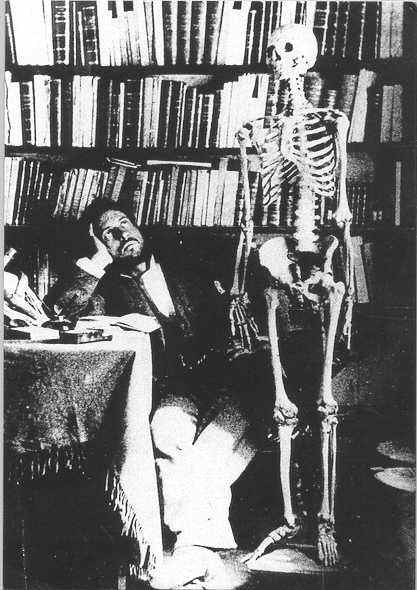
At what (x,y) coordinates should I click in order to perform the action: click on bookshelf. Please return your answer as a coordinate pair (x, y). The width and height of the screenshot is (417, 590). Looking at the image, I should click on [x=206, y=65].